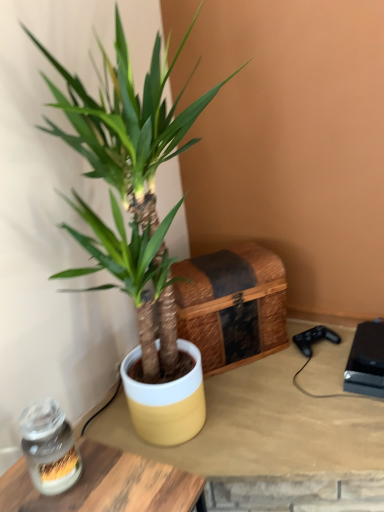
At what (x,y) coordinates should I click in order to perform the action: click on vacant space in front of woven wood chest at center. Please return your answer as a coordinate pair (x, y). Looking at the image, I should click on (259, 407).